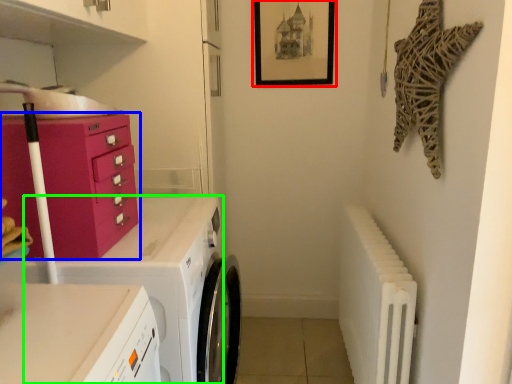
Question: Which is farther away from picture frame (highlighted by a red box)? chest of drawers (highlighted by a blue box) or home appliance (highlighted by a green box)?

Choices:
 (A) chest of drawers
 (B) home appliance

Answer: (A)